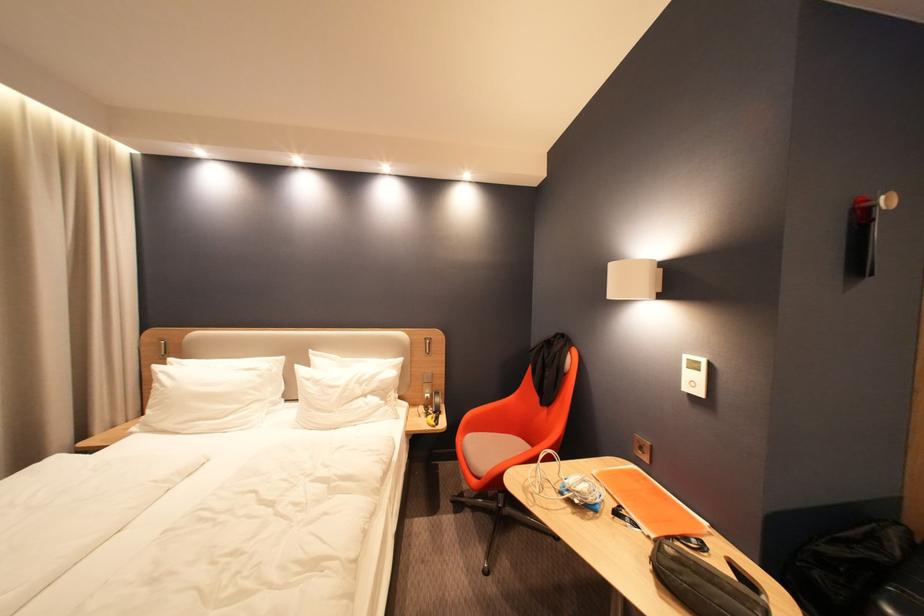
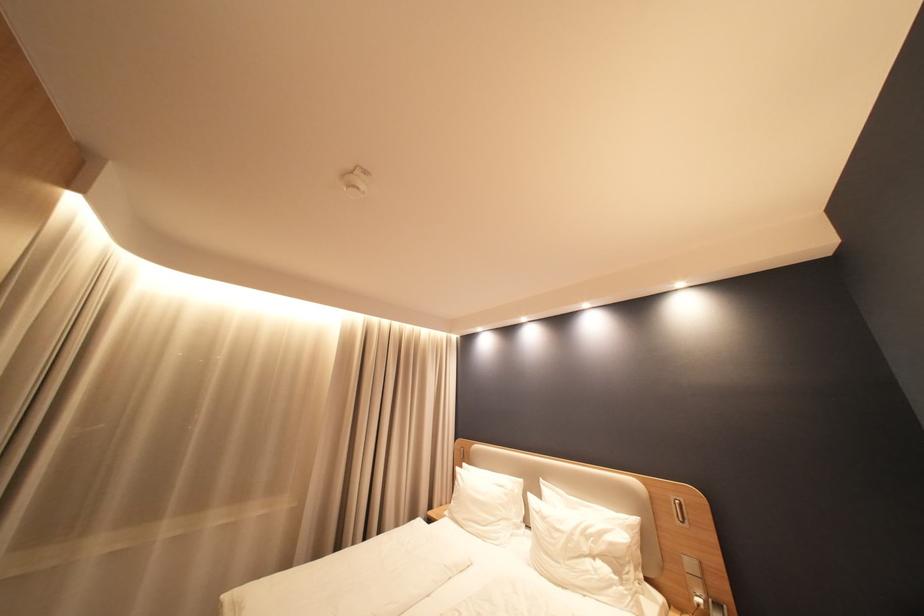
In the second image, find the point that corresponds to (x=318, y=379) in the first image.

(546, 511)